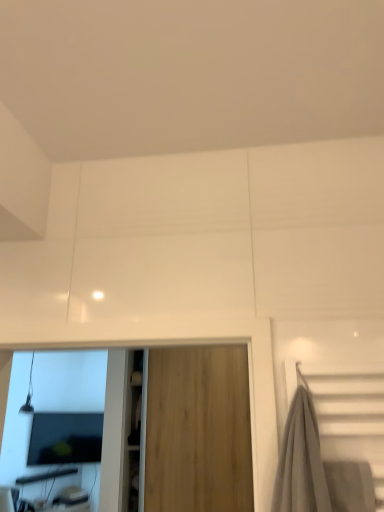
Question: Is the depth of matte black monitor at lower left greater than that of wooden door at center?

Choices:
 (A) yes
 (B) no

Answer: (A)

Question: From a real-world perspective, is matte black monitor at lower left positioned over wooden door at center based on gravity?

Choices:
 (A) no
 (B) yes

Answer: (A)

Question: From the image's perspective, is matte black monitor at lower left below wooden door at center?

Choices:
 (A) yes
 (B) no

Answer: (A)

Question: Can you confirm if matte black monitor at lower left is taller than wooden door at center?

Choices:
 (A) no
 (B) yes

Answer: (A)

Question: From a real-world perspective, is matte black monitor at lower left below wooden door at center?

Choices:
 (A) yes
 (B) no

Answer: (A)

Question: Is matte black monitor at lower left wider than wooden door at center?

Choices:
 (A) yes
 (B) no

Answer: (B)

Question: Is wooden door at center at the right side of matte black monitor at lower left?

Choices:
 (A) no
 (B) yes

Answer: (B)

Question: Does wooden door at center have a smaller size compared to matte black monitor at lower left?

Choices:
 (A) yes
 (B) no

Answer: (B)

Question: Can you see wooden door at center touching matte black monitor at lower left?

Choices:
 (A) no
 (B) yes

Answer: (A)

Question: Is wooden door at center located outside matte black monitor at lower left?

Choices:
 (A) no
 (B) yes

Answer: (B)

Question: Is matte black monitor at lower left at the back of wooden door at center?

Choices:
 (A) no
 (B) yes

Answer: (A)

Question: Does wooden door at center have a lesser width compared to matte black monitor at lower left?

Choices:
 (A) yes
 (B) no

Answer: (B)

Question: From the image's perspective, is wooden door at center positioned above or below matte black monitor at lower left?

Choices:
 (A) above
 (B) below

Answer: (A)